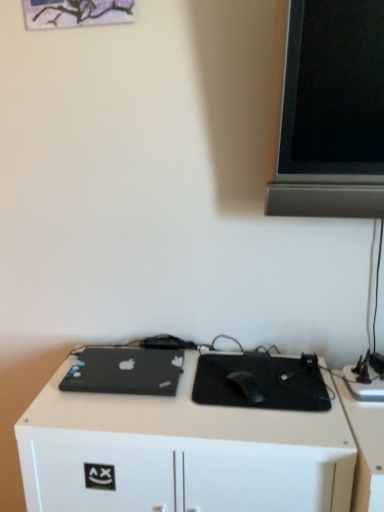
Question: Is black matte laptop at lower left thinner than white matte desk at center?

Choices:
 (A) no
 (B) yes

Answer: (B)

Question: Is black matte laptop at lower left wider than white matte desk at center?

Choices:
 (A) yes
 (B) no

Answer: (B)

Question: From a real-world perspective, is black matte laptop at lower left physically below white matte desk at center?

Choices:
 (A) no
 (B) yes

Answer: (A)

Question: Is black matte laptop at lower left shorter than white matte desk at center?

Choices:
 (A) no
 (B) yes

Answer: (B)

Question: Is black matte laptop at lower left at the left side of white matte desk at center?

Choices:
 (A) yes
 (B) no

Answer: (A)

Question: In the image, is black matte mouse at center on the left side or the right side of black matte laptop at lower left?

Choices:
 (A) left
 (B) right

Answer: (B)

Question: From the image's perspective, is black matte mouse at center positioned above or below black matte laptop at lower left?

Choices:
 (A) below
 (B) above

Answer: (A)

Question: Looking at their shapes, would you say black matte mouse at center is wider or thinner than black matte laptop at lower left?

Choices:
 (A) thin
 (B) wide

Answer: (A)

Question: Relative to black matte laptop at lower left, is black matte mouse at center in front or behind?

Choices:
 (A) behind
 (B) front

Answer: (B)

Question: In the image, is black matte mouse at center on the left side or the right side of black matte mousepad at center?

Choices:
 (A) right
 (B) left

Answer: (B)

Question: Would you say black matte mouse at center is inside or outside black matte mousepad at center?

Choices:
 (A) inside
 (B) outside

Answer: (A)

Question: From the image's perspective, is black matte mouse at center positioned above or below black matte mousepad at center?

Choices:
 (A) above
 (B) below

Answer: (A)

Question: Based on their sizes in the image, would you say black matte mouse at center is bigger or smaller than black matte mousepad at center?

Choices:
 (A) big
 (B) small

Answer: (B)

Question: In terms of width, does white matte desk at center look wider or thinner when compared to black matte laptop at lower left?

Choices:
 (A) wide
 (B) thin

Answer: (A)

Question: Is point (61, 422) closer or farther from the camera than point (89, 348)?

Choices:
 (A) closer
 (B) farther

Answer: (A)